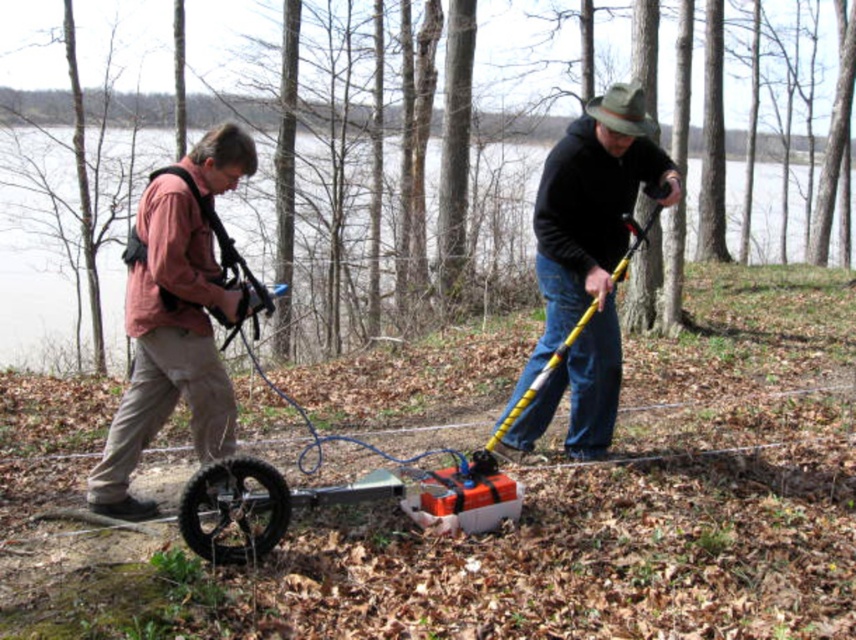
Is point (171, 228) behind point (629, 193)?

No, it is not.

Is matte pink shirt at center positioned behind black matte pole at center?

No, it is in front of black matte pole at center.

Where is `matte pink shirt at center`? The height and width of the screenshot is (640, 856). matte pink shirt at center is located at coordinates pos(175,320).